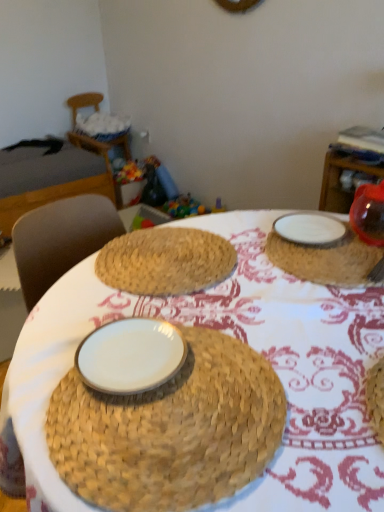
Where is `unoccupied area in front of white matte plate at upper right, arranged as the second plate when viewed from the left`? This screenshot has width=384, height=512. unoccupied area in front of white matte plate at upper right, arranged as the second plate when viewed from the left is located at coordinates (325, 267).